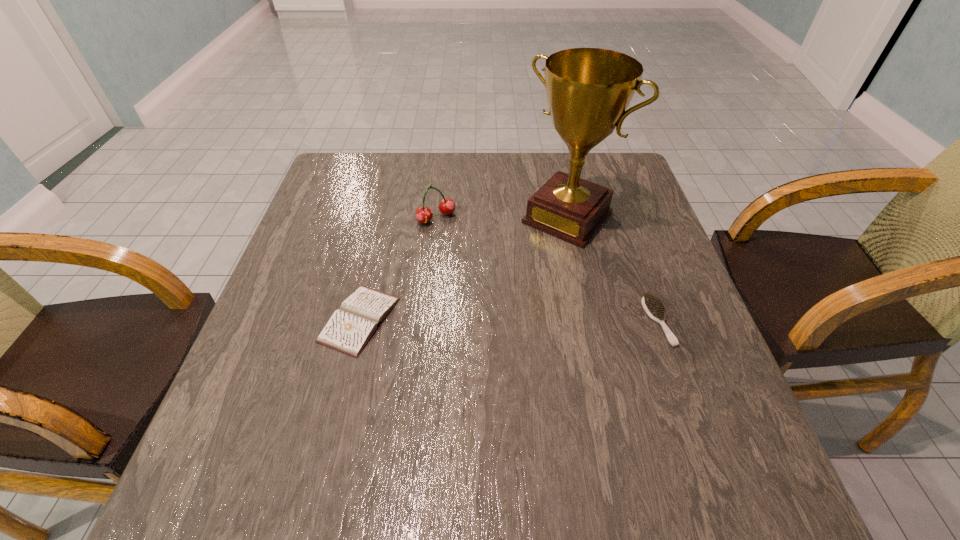
Find the location of a particular element. This screenshot has width=960, height=540. blank area located 0.260m on the plaque of the tallest object is located at coordinates 484,308.

Where is `free spot located 0.330m with stems pointing upwards on the cherry`? free spot located 0.330m with stems pointing upwards on the cherry is located at coordinates (515, 313).

The height and width of the screenshot is (540, 960). Find the location of `free space located with stems pointing upwards on the cherry`. free space located with stems pointing upwards on the cherry is located at coordinates (484, 275).

This screenshot has height=540, width=960. I want to click on free region located 0.110m with stems pointing upwards on the cherry, so click(466, 252).

This screenshot has height=540, width=960. Identify the location of object that is at the far edge. (588, 90).

I want to click on object positioned at the left edge, so click(x=351, y=326).

You are a GUI agent. You are given a task and a screenshot of the screen. Output one action in this format:
    pyautogui.click(x=<x>, y=<y>)
    Task: Click on the scrubbing brush that is at the right edge
    
    Given the screenshot: What is the action you would take?
    pyautogui.click(x=652, y=304)

The image size is (960, 540). Find the location of `award present at the right edge`. award present at the right edge is located at coordinates (588, 90).

Find the location of `object located at the far right corner`. object located at the far right corner is located at coordinates (588, 90).

Find the location of `free spot at the far edge of the desktop`. free spot at the far edge of the desktop is located at coordinates (537, 182).